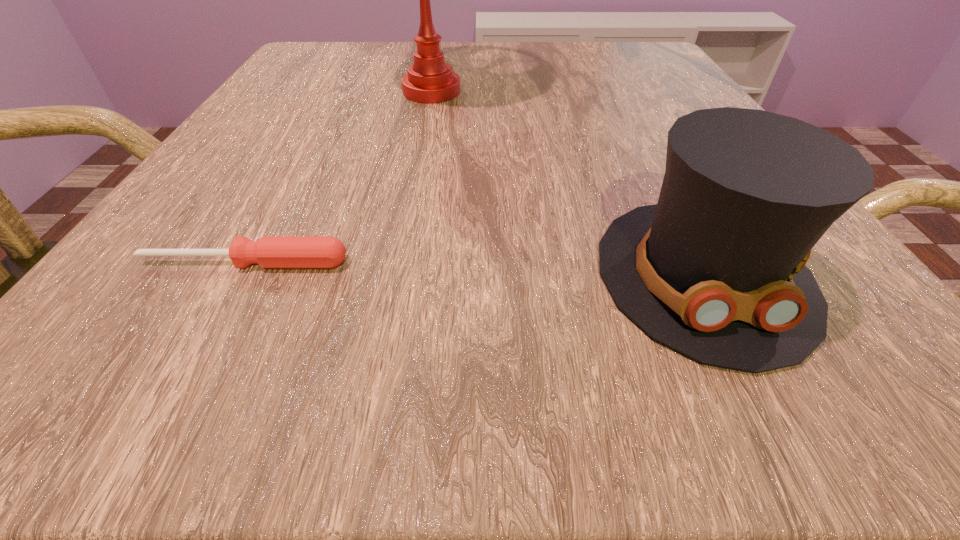
Where is `the second closest object to the second tallest object`? the second closest object to the second tallest object is located at coordinates (269, 251).

The width and height of the screenshot is (960, 540). I want to click on object that is the second nearest to the dress hat, so click(x=269, y=251).

Find the location of a particular element. free spot that satisfies the following two spatial constraints: 1. on the front-facing side of the tallest object; 2. on the front side of the screwdriver is located at coordinates (398, 263).

Identify the location of free point that satisfies the following two spatial constraints: 1. on the front-facing side of the farthest object; 2. on the front side of the screwdriver. This screenshot has height=540, width=960. tap(398, 263).